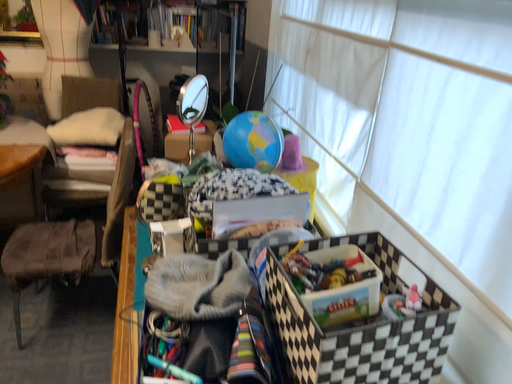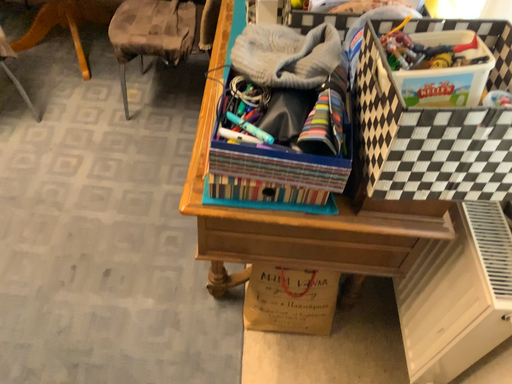
Question: Which way did the camera rotate in the video?

Choices:
 (A) rotated left
 (B) rotated right

Answer: (A)